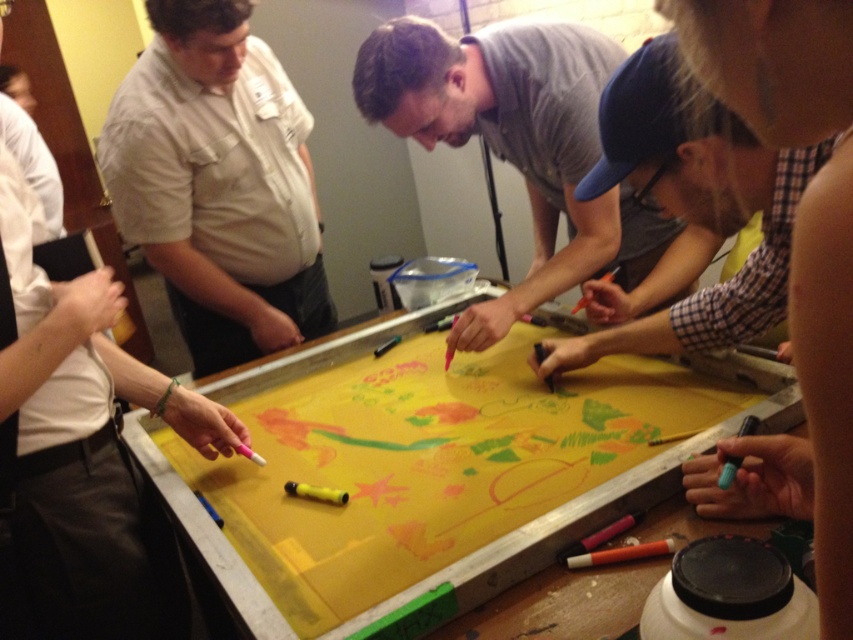
Question: Is yellow paper at center positioned in front of orange matte crayon at lower center?

Choices:
 (A) yes
 (B) no

Answer: (A)

Question: Which object is farther from the camera taking this photo?

Choices:
 (A) orange matte crayon at lower center
 (B) gray matte shirt at center
 (C) yellow paper at center

Answer: (B)

Question: From the image, what is the correct spatial relationship of gray matte shirt at center in relation to orange matte crayon at lower center?

Choices:
 (A) left
 (B) right

Answer: (A)

Question: Which point is closer to the camera taking this photo?

Choices:
 (A) (606, 563)
 (B) (233, 353)

Answer: (A)

Question: Does yellow paper at center come in front of orange matte crayon at lower center?

Choices:
 (A) no
 (B) yes

Answer: (B)

Question: Which of the following is the closest to the observer?

Choices:
 (A) (187, 116)
 (B) (554, 316)

Answer: (A)